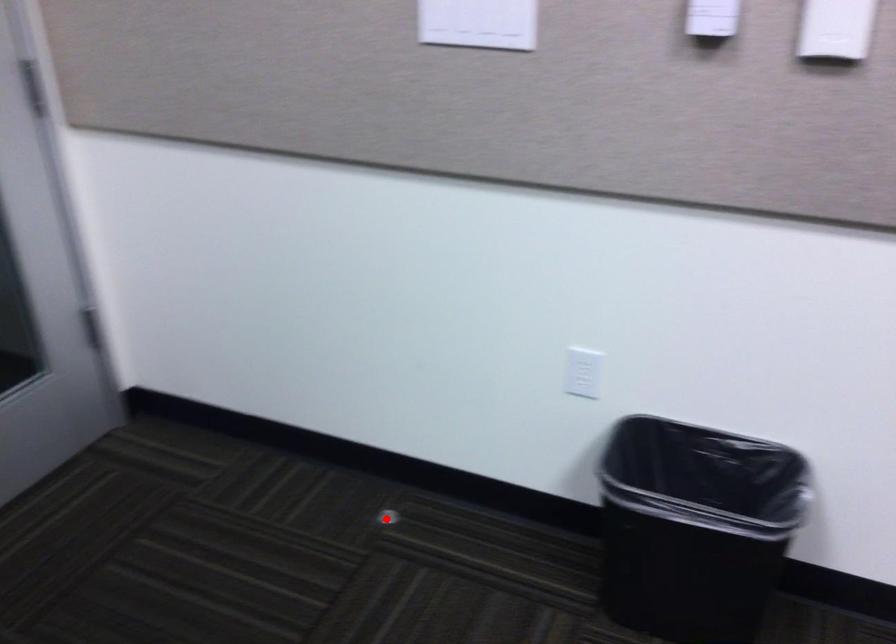
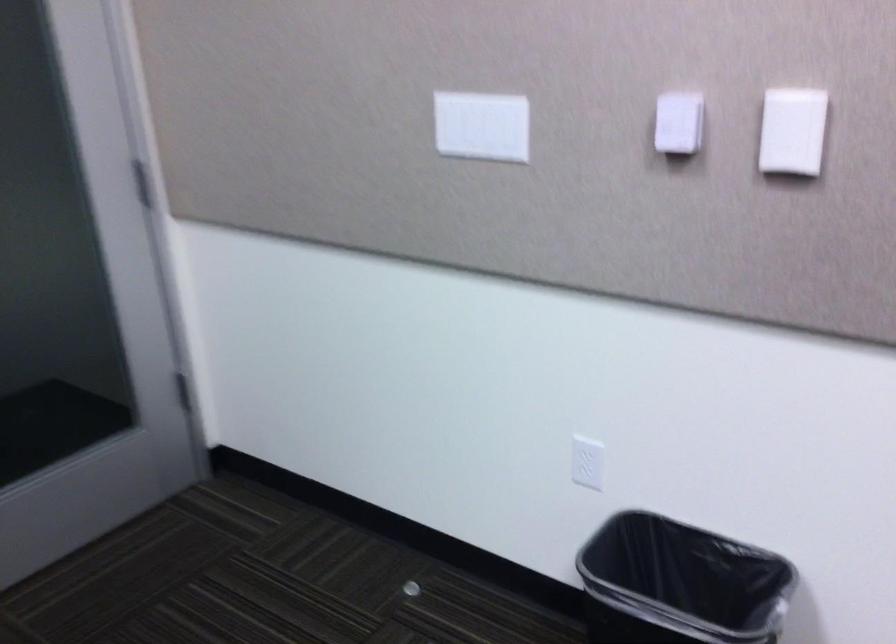
Find the pixel in the second image that matches the highlighted location in the first image.

(410, 589)